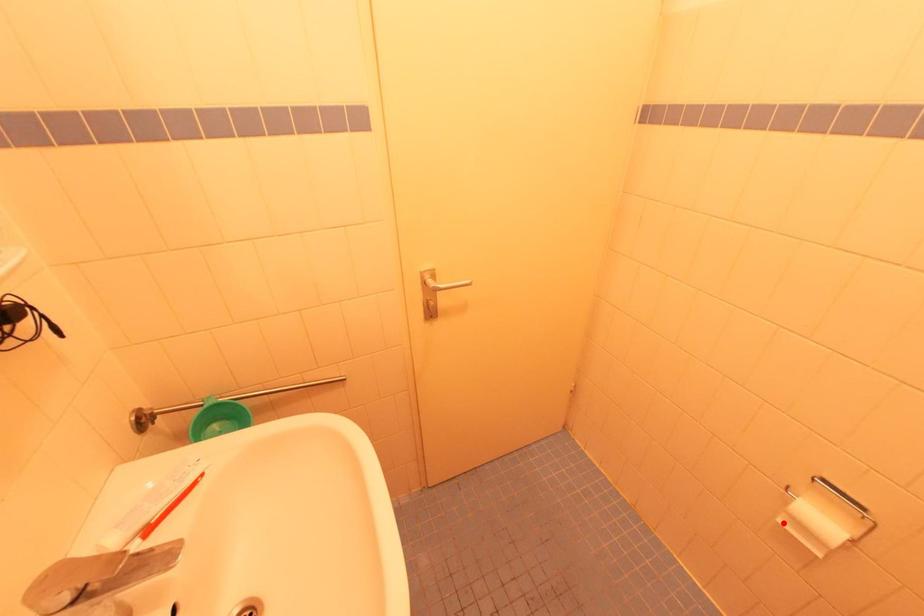
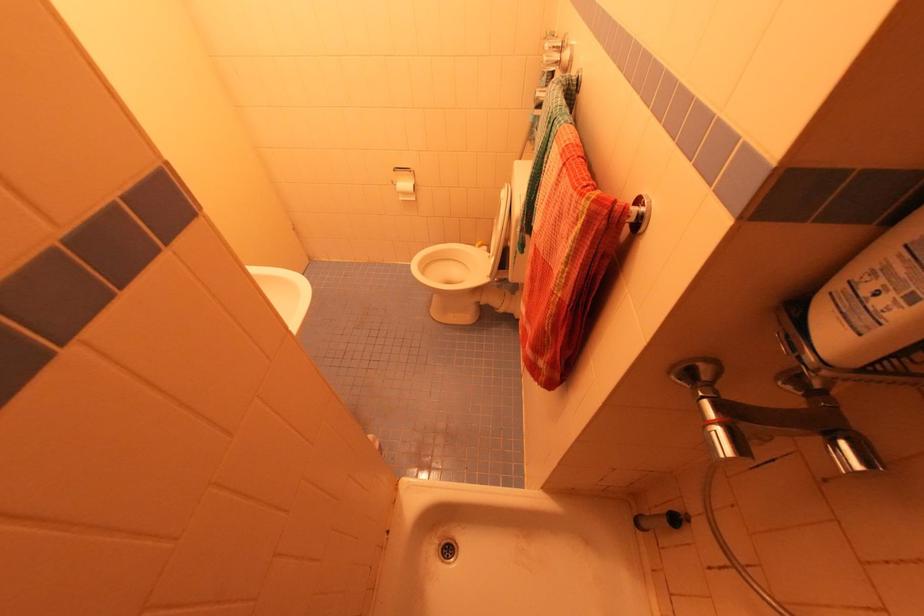
Where in the second image is the point corresponding to the highlighted location from the first image?

(403, 200)